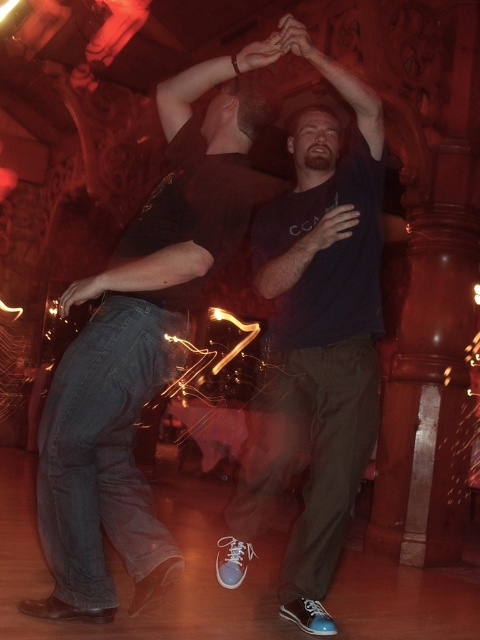
Question: Does jeans at left have a smaller size compared to dark blue t-shirt at center?

Choices:
 (A) no
 (B) yes

Answer: (B)

Question: Is the position of jeans at left more distant than that of dark blue t-shirt at center?

Choices:
 (A) yes
 (B) no

Answer: (B)

Question: Which point is farther to the camera?

Choices:
 (A) jeans at left
 (B) dark blue t-shirt at center

Answer: (B)

Question: Among these objects, which one is nearest to the camera?

Choices:
 (A) dark blue t-shirt at center
 (B) jeans at left

Answer: (B)

Question: Considering the relative positions of jeans at left and dark blue t-shirt at center in the image provided, where is jeans at left located with respect to dark blue t-shirt at center?

Choices:
 (A) left
 (B) right

Answer: (A)